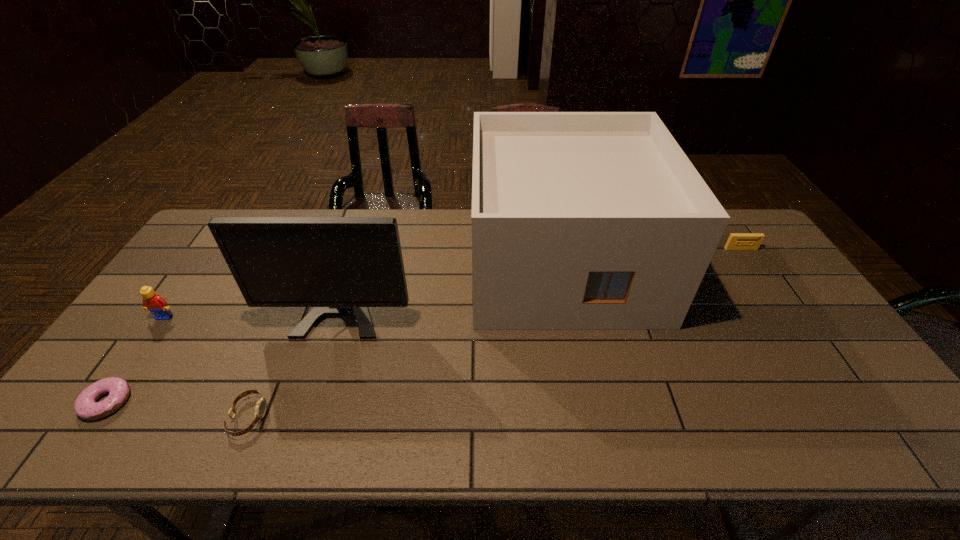
This screenshot has height=540, width=960. I want to click on vacant area that lies between the box and the computer monitor, so click(457, 269).

This screenshot has height=540, width=960. Find the location of `free space between the fifth object from left to right and the watch`. free space between the fifth object from left to right and the watch is located at coordinates (405, 340).

Image resolution: width=960 pixels, height=540 pixels. I want to click on unoccupied area between the box and the computer monitor, so click(457, 269).

At what (x,y) coordinates should I click in order to perform the action: click on object that is the closest to the computer monitor. Please return your answer as a coordinate pair (x, y). This screenshot has width=960, height=540. Looking at the image, I should click on [x=580, y=220].

Identify the location of object that can be found as the fifth closest to the fifth tallest object. The width and height of the screenshot is (960, 540). (737, 241).

At what (x,y) coordinates should I click in order to perform the action: click on vacant position in the image that satisfies the following two spatial constraints: 1. on the screen side of the computer monitor; 2. on the face of the second shortest object. Please return your answer as a coordinate pair (x, y). This screenshot has width=960, height=540. Looking at the image, I should click on (308, 417).

The image size is (960, 540). What are the coordinates of `free space in the image that satisfies the following two spatial constraints: 1. on the side of the second object from right to left with the window; 2. on the face of the fifth tallest object` in the screenshot? It's located at (594, 417).